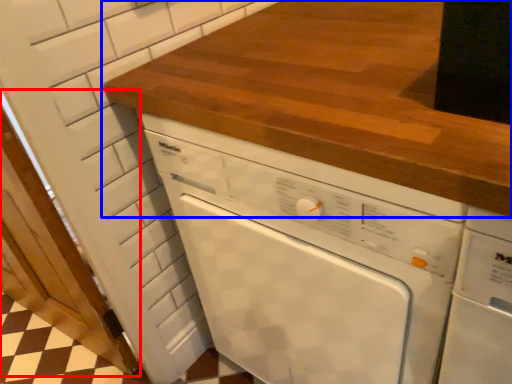
Question: Which of the following is the closest to the observer, door (highlighted by a red box) or countertop (highlighted by a blue box)?

Choices:
 (A) door
 (B) countertop

Answer: (B)